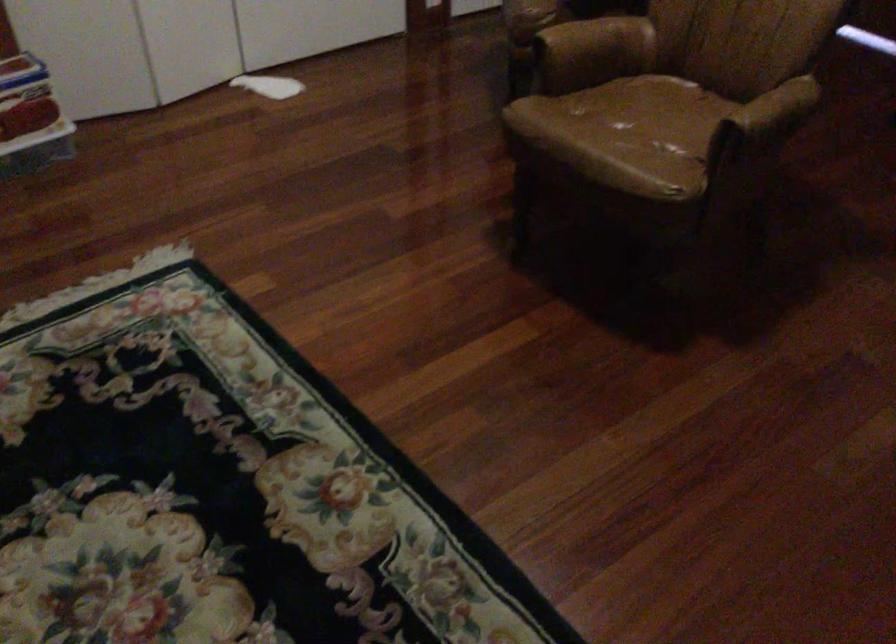
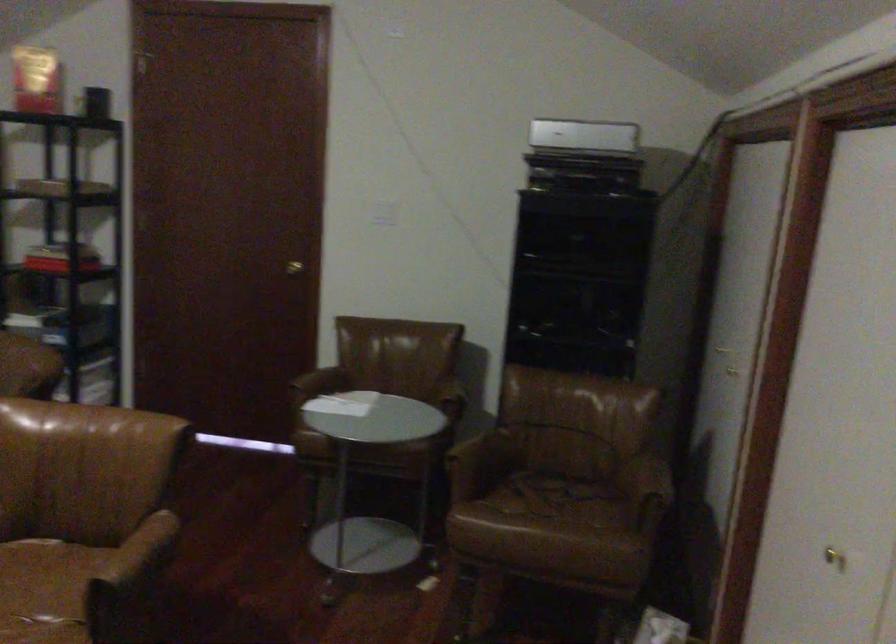
Based on the continuous images, in which direction is the camera rotating?

The rotation direction of the camera is right-up.